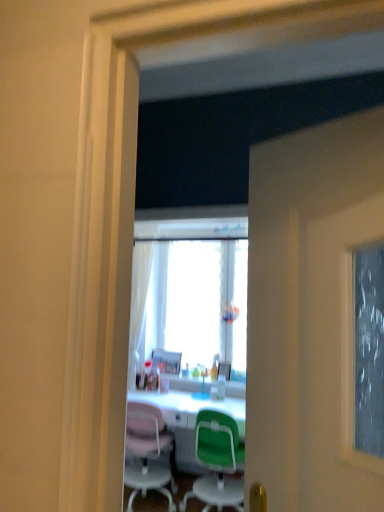
Question: From a real-world perspective, is translucent plastic bottle at center below white glossy desk at center?

Choices:
 (A) yes
 (B) no

Answer: (B)

Question: Can you confirm if translucent plastic bottle at center is thinner than white glossy desk at center?

Choices:
 (A) yes
 (B) no

Answer: (A)

Question: Does translucent plastic bottle at center have a greater width compared to white glossy desk at center?

Choices:
 (A) no
 (B) yes

Answer: (A)

Question: From the image's perspective, is translucent plastic bottle at center located above white glossy desk at center?

Choices:
 (A) yes
 (B) no

Answer: (A)

Question: Is the surface of translucent plastic bottle at center in direct contact with white glossy desk at center?

Choices:
 (A) yes
 (B) no

Answer: (B)

Question: From the image's perspective, is translucent plastic bottle at center below white glossy desk at center?

Choices:
 (A) no
 (B) yes

Answer: (A)

Question: Is green plastic chair at center wider than metallic silver picture frame at center, marked as the 1th picture frame in a right-to-left arrangement?

Choices:
 (A) no
 (B) yes

Answer: (B)

Question: Is green plastic chair at center aimed at metallic silver picture frame at center, the 1th picture frame when ordered from front to back?

Choices:
 (A) yes
 (B) no

Answer: (A)

Question: Considering the relative sizes of green plastic chair at center and metallic silver picture frame at center, marked as the 1th picture frame in a right-to-left arrangement, in the image provided, is green plastic chair at center smaller than metallic silver picture frame at center, marked as the 1th picture frame in a right-to-left arrangement,?

Choices:
 (A) no
 (B) yes

Answer: (A)

Question: Is green plastic chair at center thinner than metallic silver picture frame at center, which is the 2th picture frame in left-to-right order?

Choices:
 (A) no
 (B) yes

Answer: (A)

Question: Does green plastic chair at center lie behind metallic silver picture frame at center, which is the 2th picture frame from back to front?

Choices:
 (A) yes
 (B) no

Answer: (B)

Question: Is green plastic chair at center far away from metallic silver picture frame at center, the 1th picture frame when ordered from front to back?

Choices:
 (A) no
 (B) yes

Answer: (A)

Question: Does metallic silver picture frame at center, which is the 2th picture frame from back to front, have a larger size compared to white glossy desk at center?

Choices:
 (A) yes
 (B) no

Answer: (B)